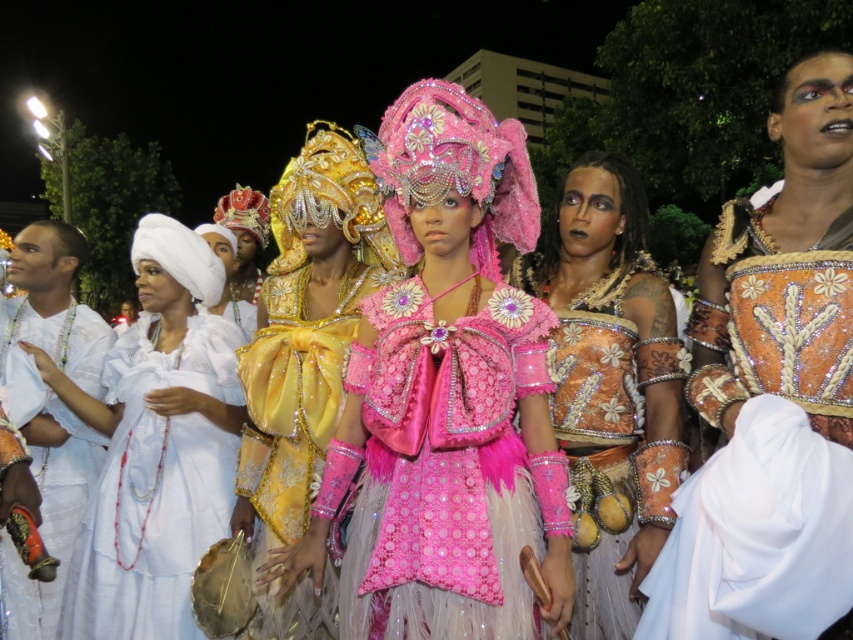
Who is more forward, (146, 339) or (285, 515)?

Point (285, 515)

Can you confirm if white satin dress at center is positioned to the right of shiny gold dress at center?

Incorrect, white satin dress at center is not on the right side of shiny gold dress at center.

At what (x,y) coordinates should I click in order to perform the action: click on white satin dress at center. Please return your answer as a coordinate pair (x, y). The height and width of the screenshot is (640, 853). Looking at the image, I should click on (155, 445).

Where is `white satin dress at center`? white satin dress at center is located at coordinates (155, 445).

The height and width of the screenshot is (640, 853). I want to click on shiny pink fabric at center, so click(x=445, y=397).

Which is behind, point (486, 298) or point (49, 467)?

Point (49, 467)

Is point (461, 413) positioned before point (67, 308)?

Yes, point (461, 413) is in front of point (67, 308).

Measure the distance between point (492,166) and camera.

Point (492,166) is 44.08 meters from camera.

Locate an element on the screen. shiny pink fabric at center is located at coordinates (445, 397).